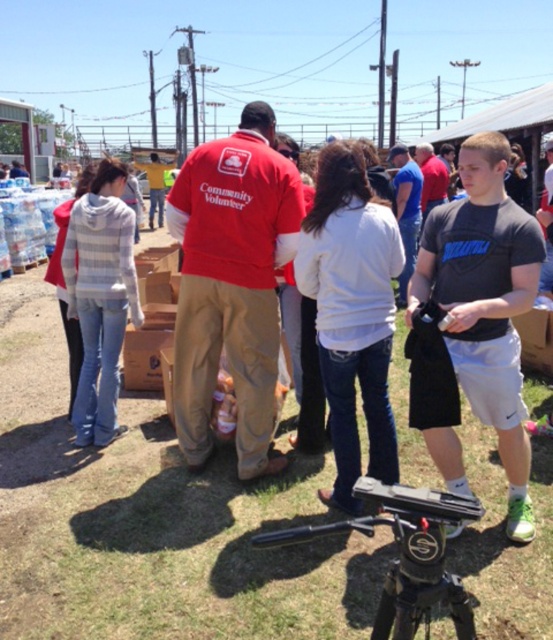
At what (x,y) coordinates should I click in order to perform the action: click on red cotton shirt at center. Please return your answer as a coordinate pair (x, y). Looking at the image, I should click on point(232,284).

Can you confirm if red cotton shirt at center is smaller than black plastic tripod at lower center?

No.

Find the location of a particular element. red cotton shirt at center is located at coordinates (232, 284).

Can you confirm if white cotton shirt at center is wider than black plastic tripod at lower center?

Yes.

Is point (378, 381) closer to viewer compared to point (430, 492)?

No.

This screenshot has height=640, width=553. Identify the location of white cotton shirt at center. (352, 312).

Is point (227, 211) positioned before point (534, 243)?

No, (227, 211) is behind (534, 243).

Does red cotton shirt at center have a greater height compared to black cotton t-shirt at center?

Yes, red cotton shirt at center is taller than black cotton t-shirt at center.

Identify the location of red cotton shirt at center. This screenshot has width=553, height=640. (232, 284).